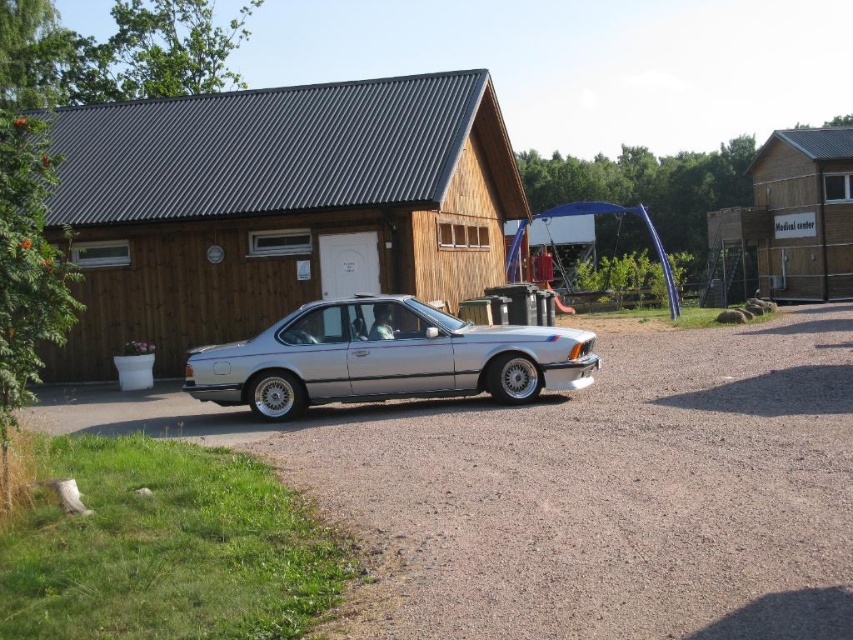
Question: Which point appears farthest from the camera in this image?

Choices:
 (A) (300, 344)
 (B) (663, 456)

Answer: (A)

Question: Which point is farther to the camera?

Choices:
 (A) (421, 461)
 (B) (337, 323)

Answer: (B)

Question: Can you confirm if silver metallic gravel at center is smaller than silver metallic sedan at center?

Choices:
 (A) no
 (B) yes

Answer: (A)

Question: Does silver metallic gravel at center have a lesser width compared to silver metallic sedan at center?

Choices:
 (A) no
 (B) yes

Answer: (A)

Question: Does silver metallic gravel at center have a smaller size compared to silver metallic sedan at center?

Choices:
 (A) yes
 (B) no

Answer: (B)